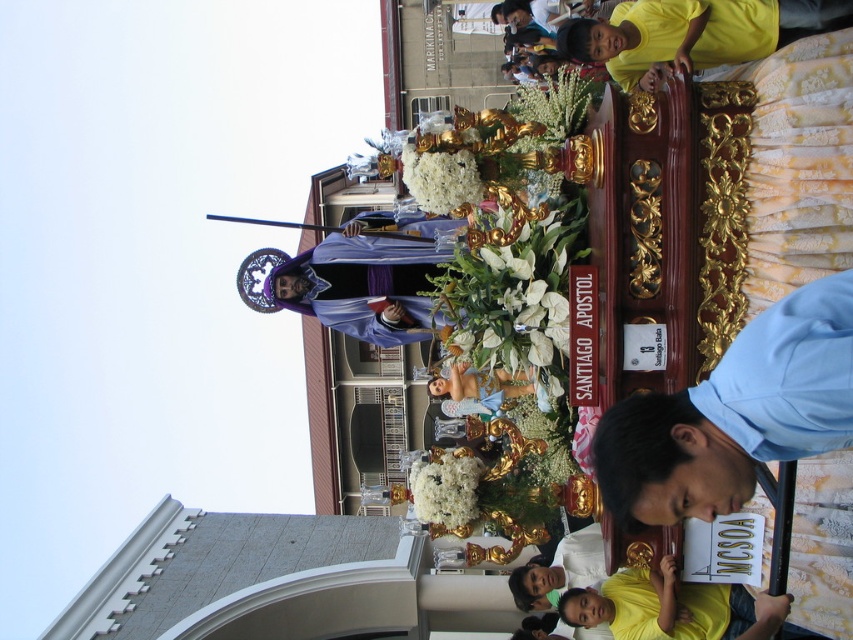
Can you confirm if light blue shirt at lower right is positioned below purple velvet robe at center?

Yes, light blue shirt at lower right is below purple velvet robe at center.

Can you confirm if light blue shirt at lower right is wider than purple velvet robe at center?

In fact, light blue shirt at lower right might be narrower than purple velvet robe at center.

Is point (662, 429) more distant than point (291, 276)?

No, (662, 429) is closer to viewer.

Identify the location of light blue shirt at lower right. This screenshot has height=640, width=853. coord(734,413).

What do you see at coordinates (352, 282) in the screenshot?
I see `purple velvet robe at center` at bounding box center [352, 282].

Between point (329, 236) and point (746, 637), which one is positioned in front?

Positioned in front is point (746, 637).

Where is `purple velvet robe at center`? The height and width of the screenshot is (640, 853). purple velvet robe at center is located at coordinates (352, 282).

Can you confirm if light blue shirt at lower right is positioned to the right of yellow matte shirt at lower right?

In fact, light blue shirt at lower right is to the left of yellow matte shirt at lower right.

Can you confirm if light blue shirt at lower right is wider than yellow matte shirt at lower right?

No, light blue shirt at lower right is not wider than yellow matte shirt at lower right.

Is point (715, 513) closer to viewer compared to point (747, 614)?

Yes, it is in front of point (747, 614).

Where is `light blue shirt at lower right`? The height and width of the screenshot is (640, 853). light blue shirt at lower right is located at coordinates (734, 413).